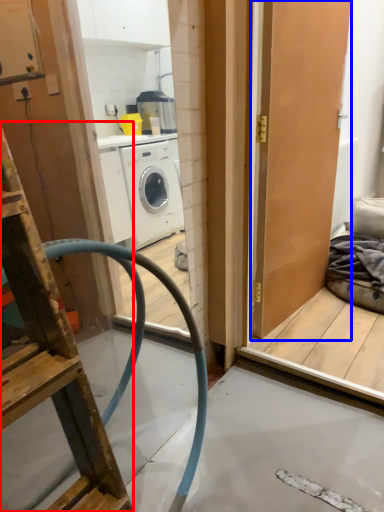
Question: Which of the following is the closest to the observer, ladder (highlighted by a red box) or door (highlighted by a blue box)?

Choices:
 (A) ladder
 (B) door

Answer: (A)